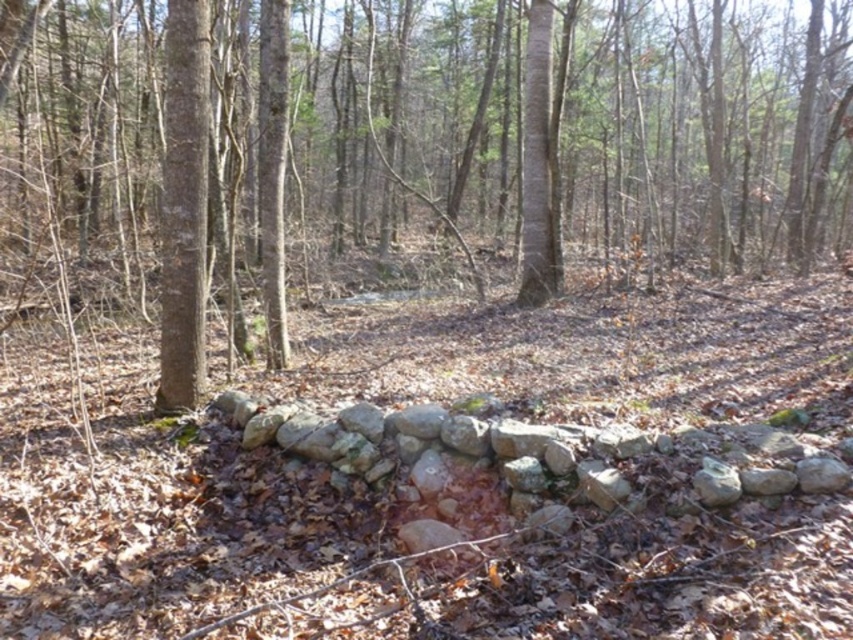
Question: Which point appears closest to the camera in this image?

Choices:
 (A) (532, 38)
 (B) (439, 131)
 (C) (187, 40)

Answer: (C)

Question: Which object is positioned farthest from the smooth brown tree trunk at left?

Choices:
 (A) smooth bark tree at center
 (B) brown rough tree at center

Answer: (B)

Question: Does brown rough tree at center lie in front of smooth brown tree trunk at left?

Choices:
 (A) yes
 (B) no

Answer: (A)

Question: Can you confirm if smooth brown tree trunk at left is thinner than smooth bark tree at center?

Choices:
 (A) yes
 (B) no

Answer: (B)

Question: Which of the following is the closest to the observer?

Choices:
 (A) brown rough tree at center
 (B) smooth bark tree at center

Answer: (A)

Question: Does brown rough tree at center have a smaller size compared to smooth bark tree at center?

Choices:
 (A) no
 (B) yes

Answer: (A)